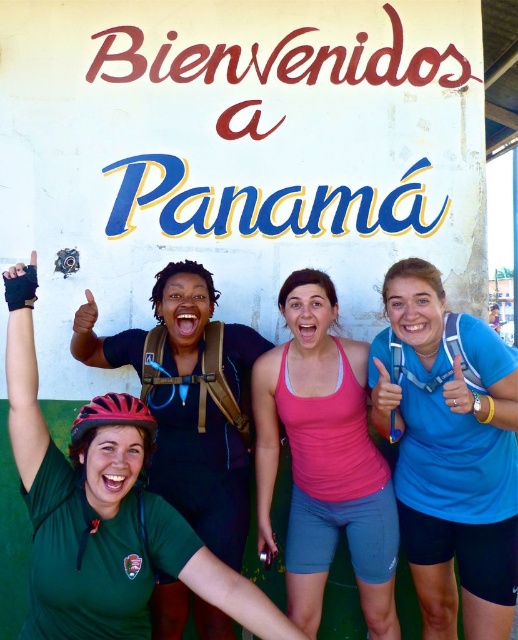
Does pink fabric tank top at center have a greater height compared to matte black helmet at lower left?

Indeed, pink fabric tank top at center has a greater height compared to matte black helmet at lower left.

Does pink fabric tank top at center have a greater width compared to matte black helmet at lower left?

No, pink fabric tank top at center is not wider than matte black helmet at lower left.

Who is more forward, (314, 529) or (165, 410)?

Point (165, 410) is in front.

Where is `pink fabric tank top at center`? The width and height of the screenshot is (518, 640). pink fabric tank top at center is located at coordinates (323, 460).

Who is positioned more to the left, blue fabric shirt at center or pink fabric tank top at center?

Positioned to the left is pink fabric tank top at center.

Which is below, blue fabric shirt at center or pink fabric tank top at center?

pink fabric tank top at center is below.

Does point (500, 500) come in front of point (326, 442)?

Yes, point (500, 500) is closer to viewer.

I want to click on blue fabric shirt at center, so tap(451, 456).

Does blue fabric shirt at center lie in front of red matte bicycle helmet at lower left?

Yes, blue fabric shirt at center is in front of red matte bicycle helmet at lower left.

Does point (442, 579) lie behind point (137, 397)?

No.

Where is `blue fabric shirt at center`? blue fabric shirt at center is located at coordinates (451, 456).